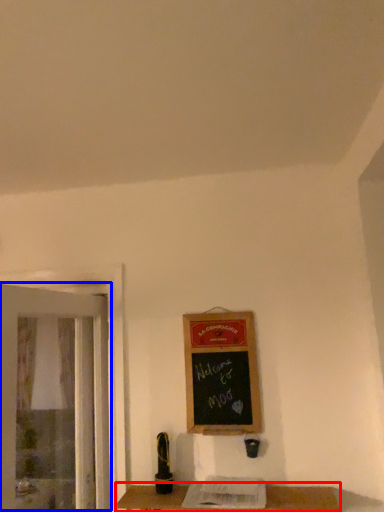
Question: Which object is further to the camera taking this photo, table (highlighted by a red box) or screen door (highlighted by a blue box)?

Choices:
 (A) table
 (B) screen door

Answer: (A)